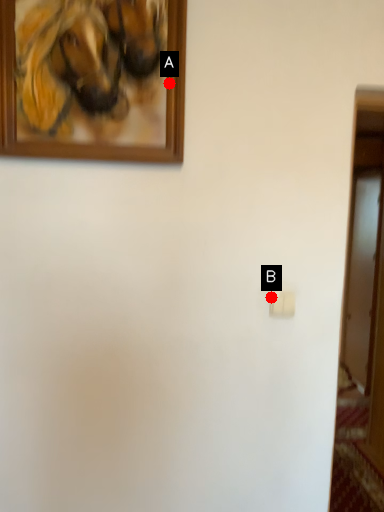
Question: Two points are circled on the image, labeled by A and B beside each circle. Which point is further to the camera?

Choices:
 (A) A is further
 (B) B is further

Answer: (B)